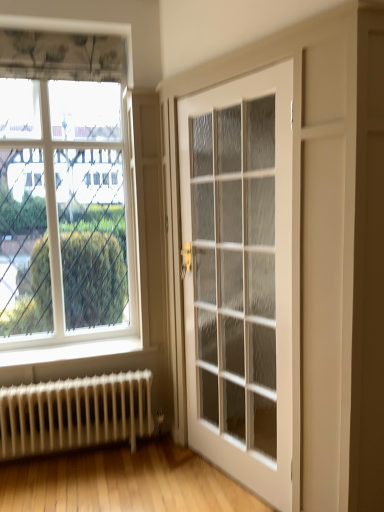
Question: Does clear glass window at upper left have a lesser width compared to white glossy door at center?

Choices:
 (A) yes
 (B) no

Answer: (A)

Question: From the image's perspective, is clear glass window at upper left on white glossy door at center?

Choices:
 (A) yes
 (B) no

Answer: (A)

Question: Can we say clear glass window at upper left lies outside white glossy door at center?

Choices:
 (A) yes
 (B) no

Answer: (A)

Question: Can you confirm if clear glass window at upper left is taller than white glossy door at center?

Choices:
 (A) yes
 (B) no

Answer: (B)

Question: Is white glossy door at center a part of clear glass window at upper left?

Choices:
 (A) yes
 (B) no

Answer: (B)

Question: From a real-world perspective, is white metal radiator at lower left positioned above or below clear glass window at upper left?

Choices:
 (A) above
 (B) below

Answer: (B)

Question: Considering the positions of white metal radiator at lower left and clear glass window at upper left in the image, is white metal radiator at lower left bigger or smaller than clear glass window at upper left?

Choices:
 (A) small
 (B) big

Answer: (A)

Question: Would you say white metal radiator at lower left is to the left or to the right of clear glass window at upper left in the picture?

Choices:
 (A) left
 (B) right

Answer: (B)

Question: Would you say white metal radiator at lower left is inside or outside clear glass window at upper left?

Choices:
 (A) inside
 (B) outside

Answer: (B)

Question: Considering the positions of clear glass window at upper left and white glossy door at center in the image, is clear glass window at upper left taller or shorter than white glossy door at center?

Choices:
 (A) short
 (B) tall

Answer: (A)

Question: From the image's perspective, is clear glass window at upper left located above or below white glossy door at center?

Choices:
 (A) above
 (B) below

Answer: (A)

Question: Considering the relative positions of clear glass window at upper left and white glossy door at center in the image provided, is clear glass window at upper left to the left or to the right of white glossy door at center?

Choices:
 (A) left
 (B) right

Answer: (A)

Question: Is point (18, 53) closer or farther from the camera than point (203, 420)?

Choices:
 (A) closer
 (B) farther

Answer: (A)

Question: In terms of size, does white glossy door at center appear bigger or smaller than clear glass window at upper left?

Choices:
 (A) small
 (B) big

Answer: (B)

Question: In the image, is white glossy door at center on the left side or the right side of clear glass window at upper left?

Choices:
 (A) left
 (B) right

Answer: (B)